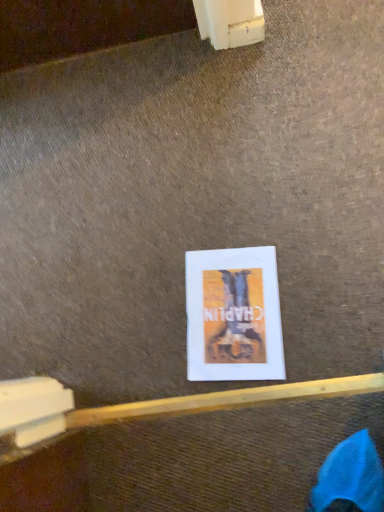
Describe the element at coordinates (233, 315) in the screenshot. This screenshot has height=512, width=384. I see `white paper at center` at that location.

Locate an element on the screen. The width and height of the screenshot is (384, 512). white paper at center is located at coordinates (233, 315).

Measure the distance between point (252,269) and camera.

They are 98.30 centimeters apart.

The width and height of the screenshot is (384, 512). What are the coordinates of `white paper at center` in the screenshot? It's located at (233, 315).